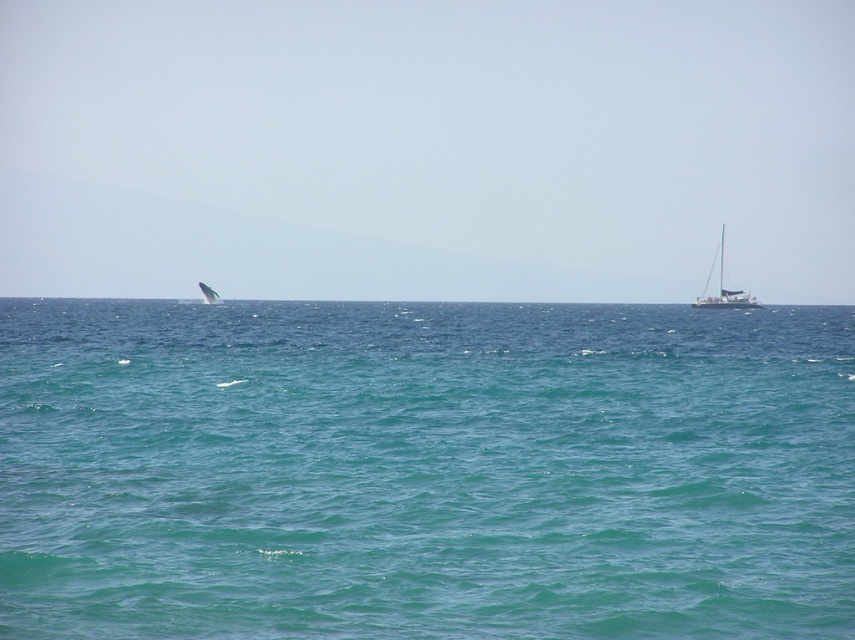
Consider the image. You are standing on the deck of a boat in the middle of the ocean. You see a point marked at coordinates (723, 288). What object is located at that point?

The point at coordinates (723, 288) corresponds to the black matte sailboat at right.

You are standing at the camera position observing the seascape. There is a point at coordinates point [118,493]. Can you reach that point by walking 20 meters straight ahead?

The distance of point [118,493] from camera is 17.98 meters, so yes, you can reach it by walking 20 meters straight ahead since it is within the distance.

You are a photographer trying to capture the black matte sailboat at right in your shot. The teal glossy water at center is reflecting the sky. Will the sailboat appear taller or shorter than the water in the photo?

The black matte sailboat at right appears taller than the teal glossy water at center because the teal glossy water at center is not as tall as the black matte sailboat at right in the image.